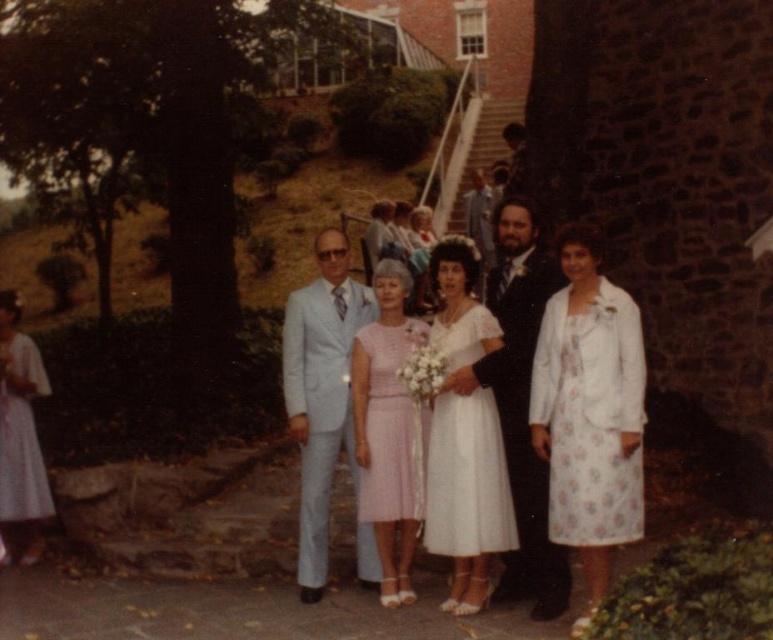
Question: Which object appears closest to the camera in this image?

Choices:
 (A) white floral dress at center
 (B) white satin dress at center

Answer: (A)

Question: Which object is the closest to the white floral dress at left?

Choices:
 (A) light blue fabric suit at center
 (B) matte black suit at center
 (C) white satin dress at center
 (D) pink textured dress at center

Answer: (A)

Question: Where is white floral dress at center located in relation to pink textured dress at center in the image?

Choices:
 (A) right
 (B) left

Answer: (A)

Question: Based on their relative distances, which object is farther from the white satin dress at center?

Choices:
 (A) white floral dress at center
 (B) white floral dress at left
 (C) light blue fabric suit at center
 (D) pink textured dress at center

Answer: (B)

Question: Can you confirm if matte black suit at center is positioned below white floral dress at left?

Choices:
 (A) yes
 (B) no

Answer: (A)

Question: Where is light blue fabric suit at center located in relation to matte black suit at center in the image?

Choices:
 (A) left
 (B) right

Answer: (A)